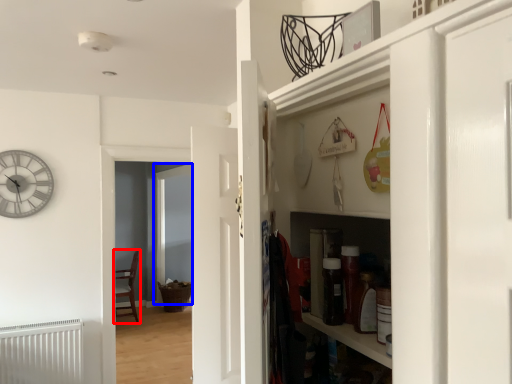
Question: Which object is closer to the camera taking this photo, chair (highlighted by a red box) or glass door (highlighted by a blue box)?

Choices:
 (A) chair
 (B) glass door

Answer: (B)